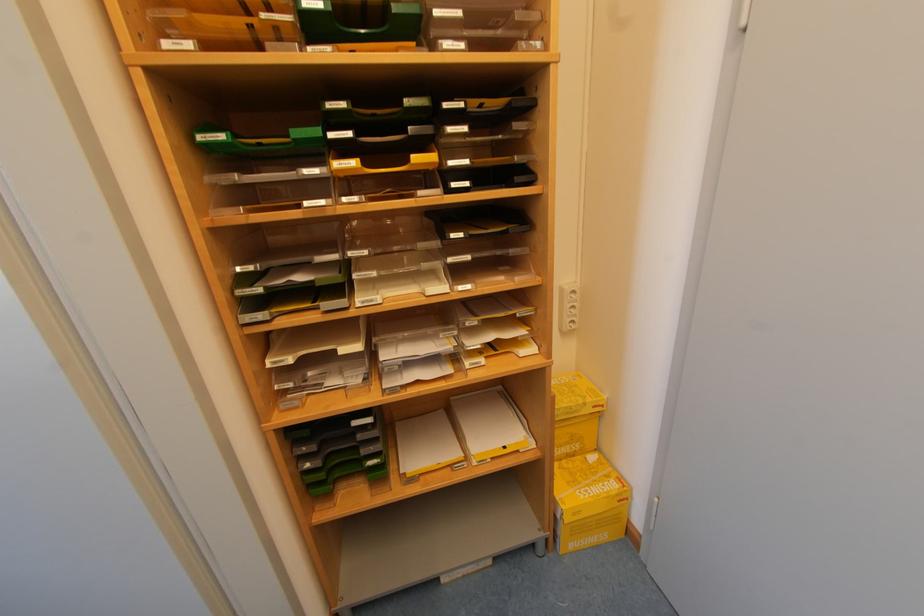
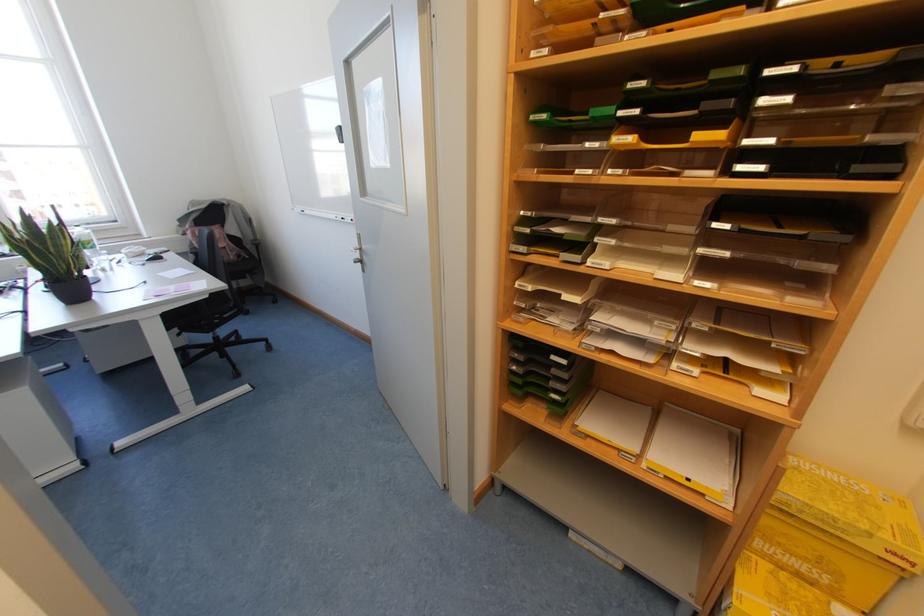
The point at [572,447] is marked in the first image. Where is the corresponding point in the second image?

(813, 573)